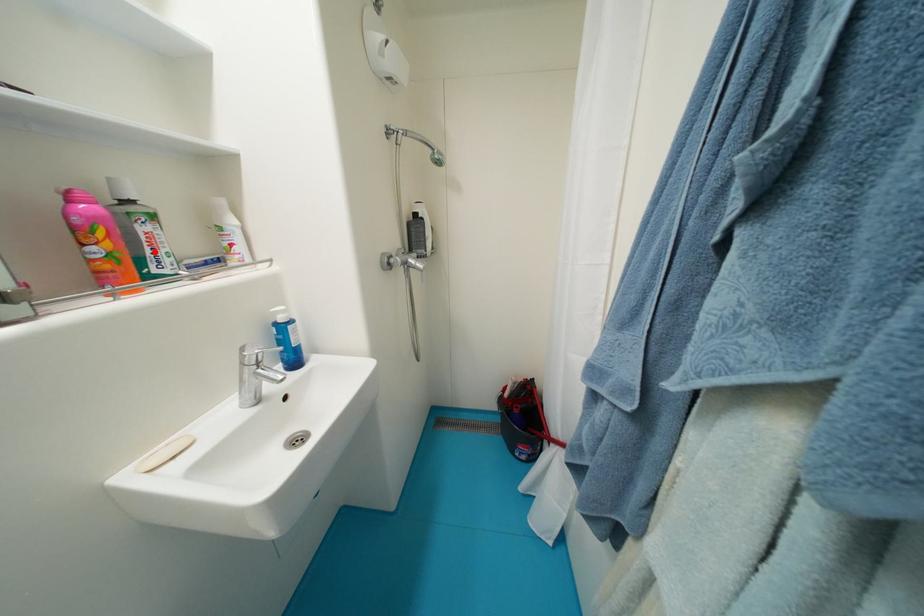
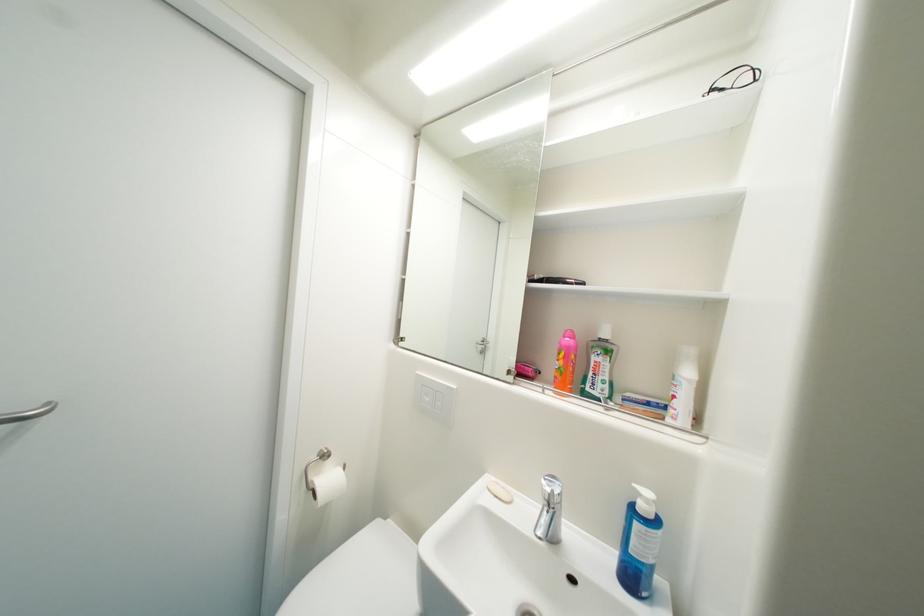
The point at the highlighted location is marked in the first image. Where is the corresponding point in the second image?

(598, 376)